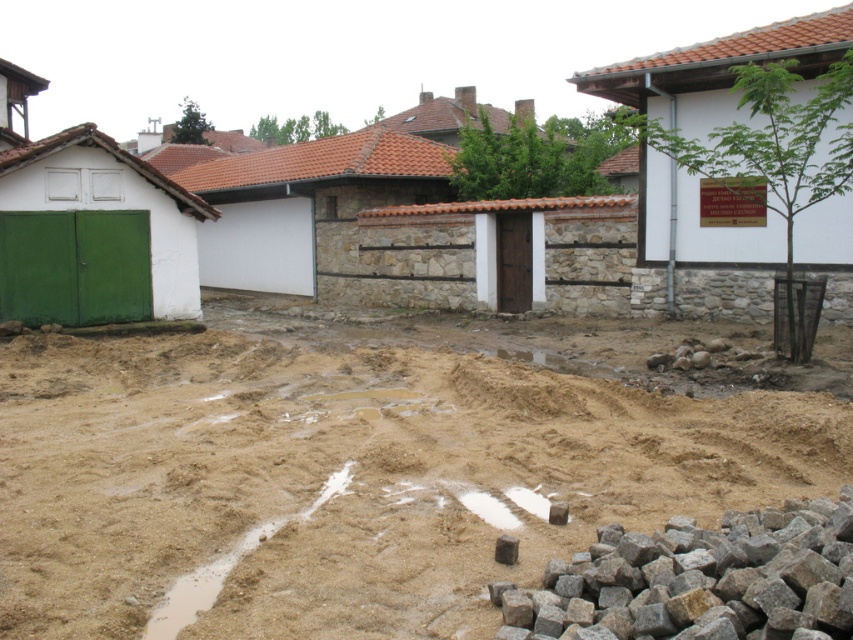
Question: Among these points, which one is farthest from the camera?

Choices:
 (A) (178, 518)
 (B) (503, 548)
 (C) (585, 557)

Answer: (A)

Question: Does brown sandy dirt at center lie behind brown rough stone at lower right?

Choices:
 (A) yes
 (B) no

Answer: (B)

Question: Is the position of brown sandy dirt at center less distant than that of brown rough stone at lower right?

Choices:
 (A) no
 (B) yes

Answer: (B)

Question: Which point is farther to the camera?

Choices:
 (A) (689, 563)
 (B) (502, 538)

Answer: (B)

Question: Among these objects, which one is nearest to the camera?

Choices:
 (A) gray stone at lower right
 (B) brown rough stone at lower right

Answer: (A)

Question: Does brown sandy dirt at center appear on the right side of gray stone at lower right?

Choices:
 (A) no
 (B) yes

Answer: (A)